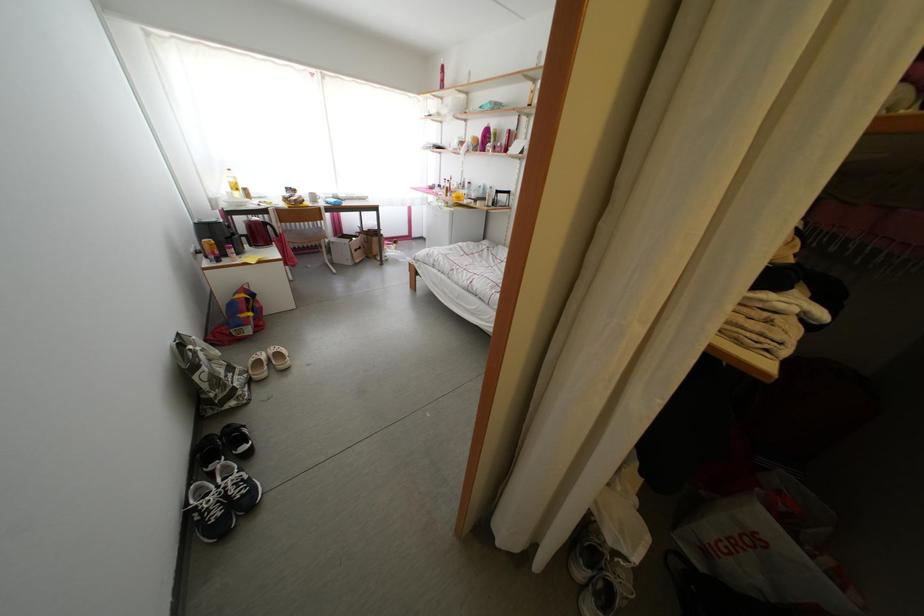
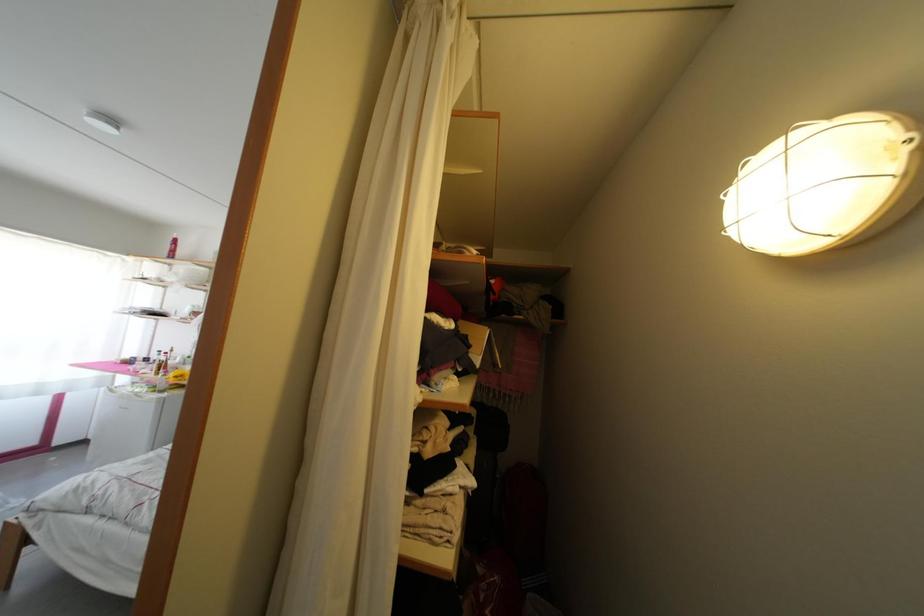
First-person continuous shooting, in which direction is the camera rotating?

The camera rotated toward right-up.